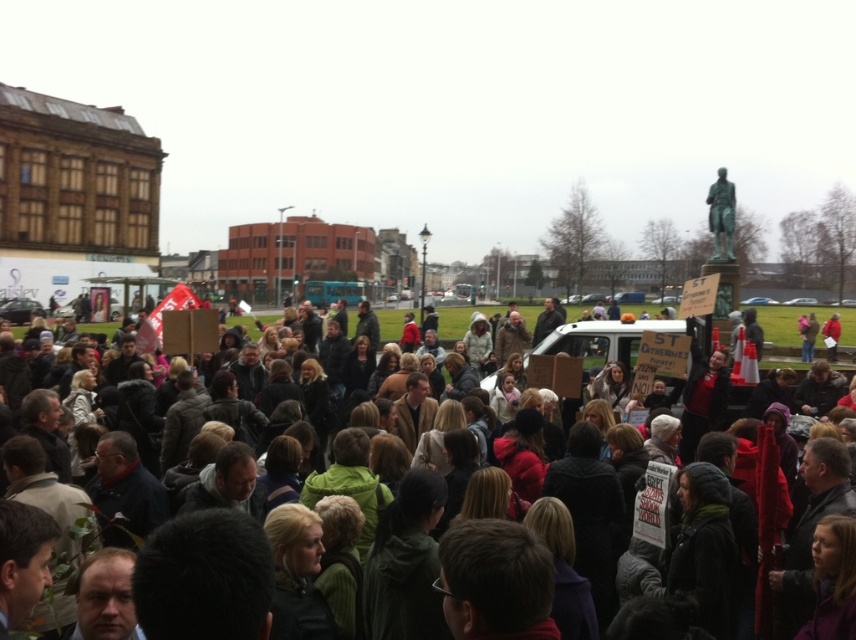
Is dark gray clothing at center positioned in front of green polished statue at upper right?

Yes, it is.

Can you confirm if dark gray clothing at center is thinner than green polished statue at upper right?

In fact, dark gray clothing at center might be wider than green polished statue at upper right.

Consider the image. Who is more distant from viewer, (783, 330) or (723, 230)?

Point (783, 330)

Locate an element on the screen. This screenshot has height=640, width=856. dark gray clothing at center is located at coordinates (785, 333).